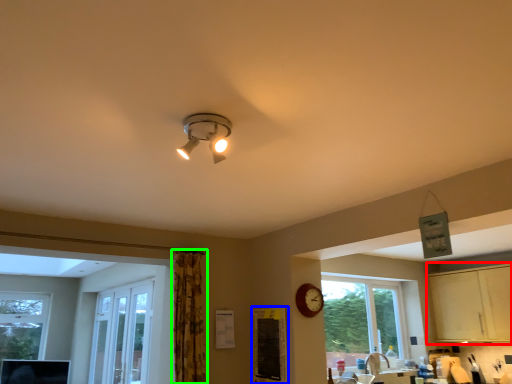
Question: Which is farther away from dresser (highlighted by a red box)? bulletin board (highlighted by a blue box) or curtain (highlighted by a green box)?

Choices:
 (A) bulletin board
 (B) curtain

Answer: (B)